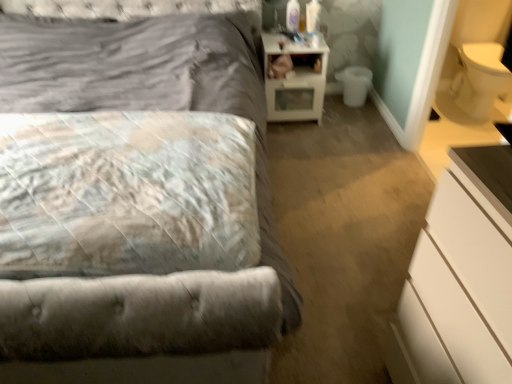
Question: Is white matte chest of drawers at lower right outside of white glossy nightstand at upper right?

Choices:
 (A) no
 (B) yes

Answer: (B)

Question: Considering the relative sizes of white matte chest of drawers at lower right and white glossy nightstand at upper right in the image provided, is white matte chest of drawers at lower right taller than white glossy nightstand at upper right?

Choices:
 (A) no
 (B) yes

Answer: (B)

Question: Can you confirm if white matte chest of drawers at lower right is shorter than white glossy nightstand at upper right?

Choices:
 (A) no
 (B) yes

Answer: (A)

Question: Is white matte chest of drawers at lower right next to white glossy nightstand at upper right and touching it?

Choices:
 (A) no
 (B) yes

Answer: (A)

Question: Is white matte chest of drawers at lower right at the right side of white glossy nightstand at upper right?

Choices:
 (A) no
 (B) yes

Answer: (B)

Question: Does white matte chest of drawers at lower right have a greater width compared to white glossy nightstand at upper right?

Choices:
 (A) no
 (B) yes

Answer: (B)

Question: Is white matte chest of drawers at lower right located outside fluffy white pillow at left?

Choices:
 (A) no
 (B) yes

Answer: (B)

Question: Considering the relative positions of white matte chest of drawers at lower right and fluffy white pillow at left in the image provided, is white matte chest of drawers at lower right to the right of fluffy white pillow at left from the viewer's perspective?

Choices:
 (A) yes
 (B) no

Answer: (A)

Question: Is white matte chest of drawers at lower right facing towards fluffy white pillow at left?

Choices:
 (A) yes
 (B) no

Answer: (B)

Question: Are white matte chest of drawers at lower right and fluffy white pillow at left beside each other?

Choices:
 (A) yes
 (B) no

Answer: (B)

Question: From the image's perspective, is white matte chest of drawers at lower right above fluffy white pillow at left?

Choices:
 (A) no
 (B) yes

Answer: (A)

Question: Is white matte chest of drawers at lower right thinner than fluffy white pillow at left?

Choices:
 (A) yes
 (B) no

Answer: (A)

Question: Is fluffy white pillow at left placed right next to white glossy nightstand at upper right?

Choices:
 (A) no
 (B) yes

Answer: (A)